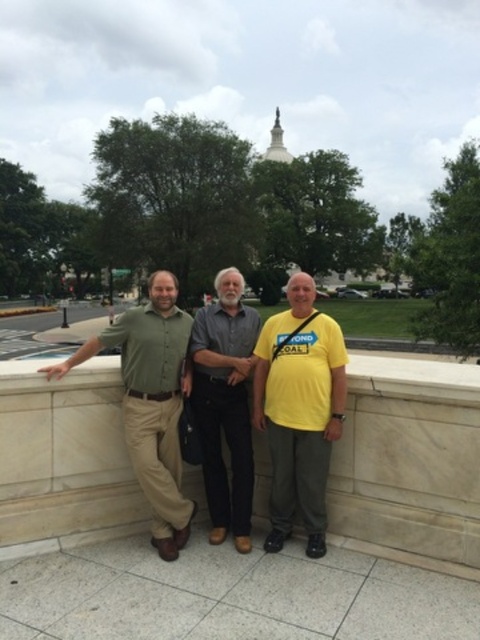
Can you confirm if matte green shirt at center is smaller than dark gray cotton shirt at center?

Incorrect, matte green shirt at center is not smaller in size than dark gray cotton shirt at center.

Is matte green shirt at center to the left of dark gray cotton shirt at center from the viewer's perspective?

Correct, you'll find matte green shirt at center to the left of dark gray cotton shirt at center.

Is point (336, 413) positioned before point (247, 502)?

Yes, it is.

I want to click on matte green shirt at center, so click(x=225, y=400).

Does matte green shirt at center come in front of green matte shirt at left?

Yes, matte green shirt at center is in front of green matte shirt at left.

Who is lower down, matte green shirt at center or green matte shirt at left?

green matte shirt at left is lower down.

Between point (338, 362) and point (184, 390), which one is positioned behind?

The point (184, 390) is behind.

Locate an element on the screen. The width and height of the screenshot is (480, 640). matte green shirt at center is located at coordinates (225, 400).

Between yellow matte shirt at center and dark gray cotton shirt at center, which one has less height?

Standing shorter between the two is yellow matte shirt at center.

Who is more forward, (282, 365) or (242, 461)?

Point (282, 365) is more forward.

This screenshot has width=480, height=640. Identify the location of yellow matte shirt at center. (299, 410).